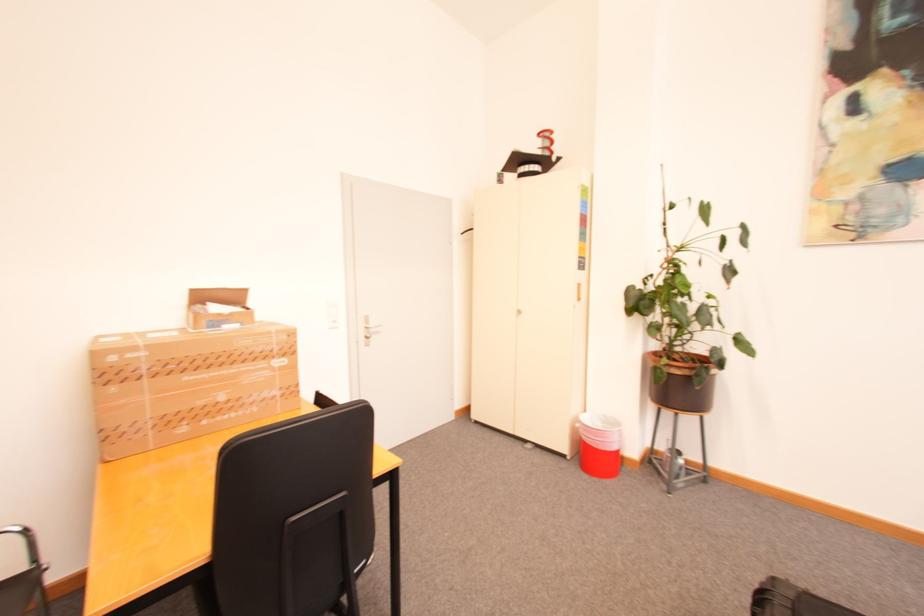
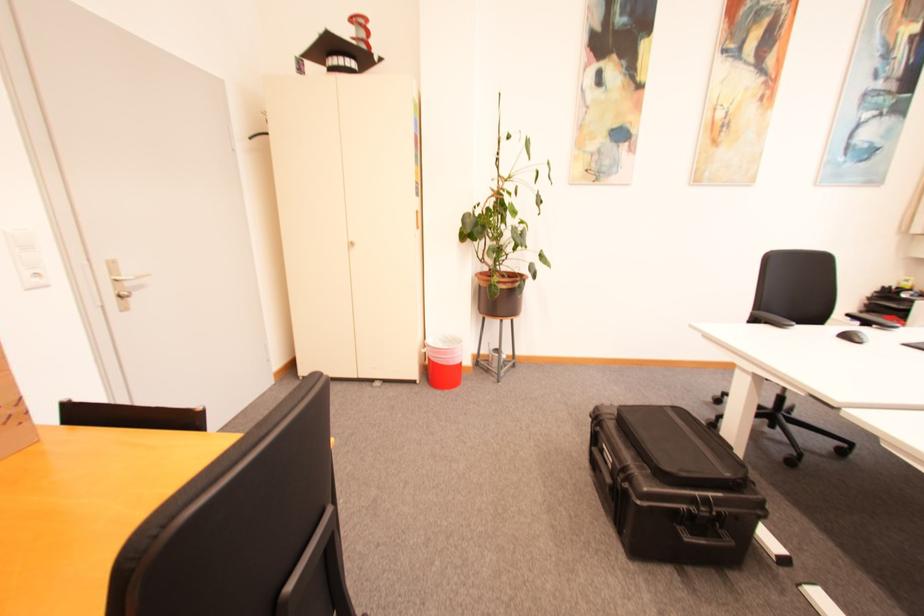
Locate, in the second image, the point that corresponds to point 378,331 in the first image.

(134, 285)